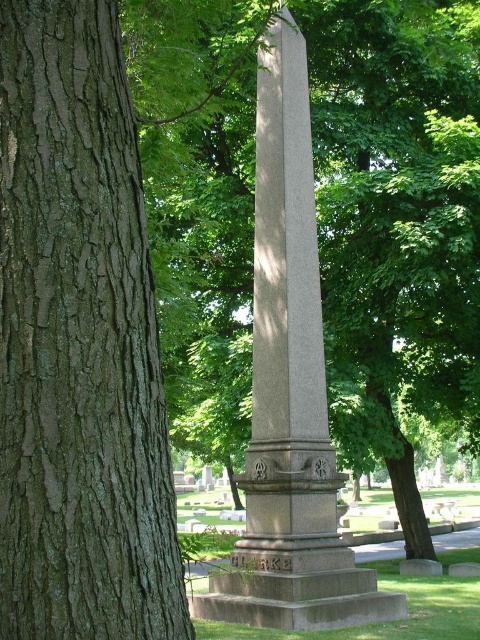
You are a photographer trying to capture both the brown rough bark at left and the gray stone obelisk at center in a single frame. Based on their sizes, which object should you focus on first to ensure both fit in the shot?

The brown rough bark at left is smaller than the gray stone obelisk at center, so you should focus on framing the larger gray stone obelisk at center first to ensure both objects fit in the shot.

You are a landscape architect designing a new garden and want to place a brown rough bark at left and a gray stone obelisk at center. Given their widths, which object should be placed closer to the pathway to ensure visitors can easily walk between them?

The brown rough bark at left has a smaller width than the gray stone obelisk at center, so placing the brown rough bark at left closer to the pathway would allow for easier passage between them.

You are standing in the cemetery and want to touch the point at coordinates [79,342]. Based on the scene description, what surface will your hand come into contact with?

The point at coordinates [79,342] is on brown rough bark at left, so your hand will come into contact with the brown rough bark.